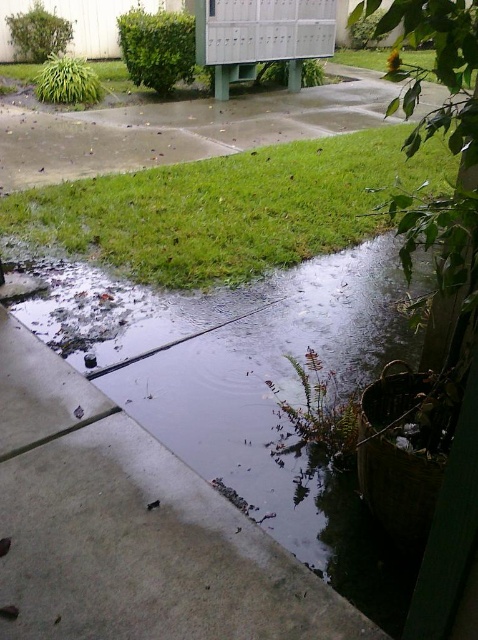
Is gray concrete pavement at lower center thinner than green grass at lower left?

Yes.

Which is in front, point (77, 538) or point (167, 211)?

Point (77, 538) is in front.

The width and height of the screenshot is (478, 640). I want to click on gray concrete pavement at lower center, so click(130, 528).